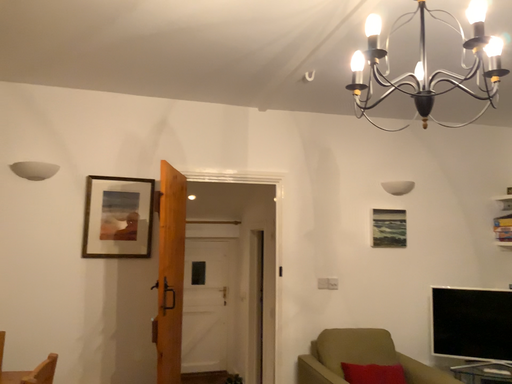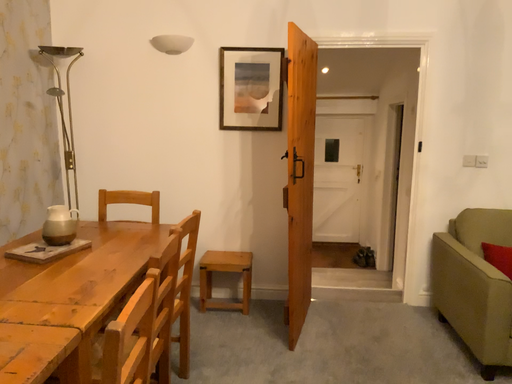
Question: How did the camera likely rotate when shooting the video?

Choices:
 (A) rotated left
 (B) rotated right

Answer: (A)